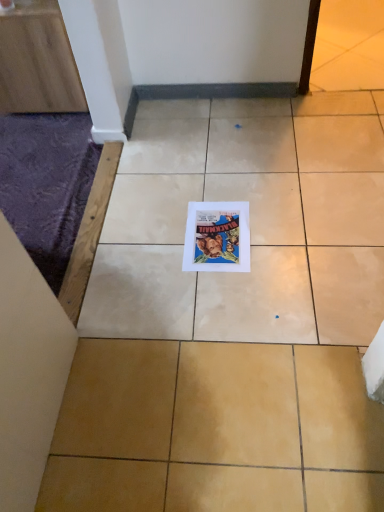
I want to click on spots to the right of matte paper comic book at center, so click(288, 229).